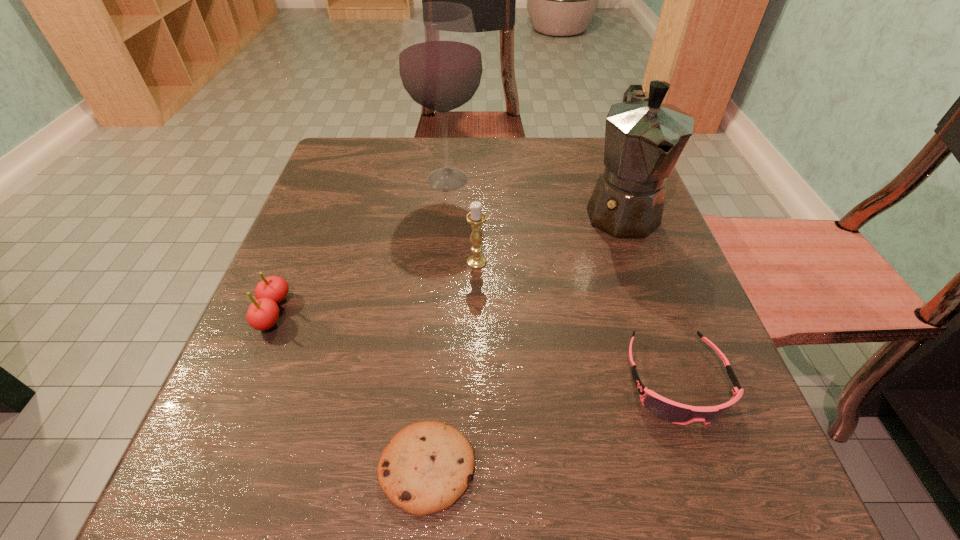
At what (x,y) coordinates should I click in order to perform the action: click on the tallest object. Please return your answer as a coordinate pair (x, y). This screenshot has height=540, width=960. Looking at the image, I should click on [x=440, y=63].

Where is `the second tallest object`? The width and height of the screenshot is (960, 540). the second tallest object is located at coordinates (644, 138).

Where is `candle holder`? The width and height of the screenshot is (960, 540). candle holder is located at coordinates (475, 217).

Identify the location of the fourth nearest object. The width and height of the screenshot is (960, 540). (475, 217).

The image size is (960, 540). What are the coordinates of `the fourth farthest object` in the screenshot? It's located at (263, 313).

This screenshot has height=540, width=960. I want to click on the leftmost object, so click(263, 313).

Find the location of a particular element. The height and width of the screenshot is (540, 960). the fifth tallest object is located at coordinates (671, 411).

This screenshot has width=960, height=540. What are the coordinates of `cookie` in the screenshot? It's located at (428, 465).

You are a GUI agent. You are given a task and a screenshot of the screen. Output one action in this format:
    pyautogui.click(x=<x>, y=<y>)
    Task: Click on the free space located on the front of the alcohol
    Image resolution: width=960 pixels, height=540 pixels.
    Given the screenshot: What is the action you would take?
    pyautogui.click(x=443, y=238)

Find the location of `vacant region located 0.100m on the pouring side of the coffeepot`. vacant region located 0.100m on the pouring side of the coffeepot is located at coordinates (649, 290).